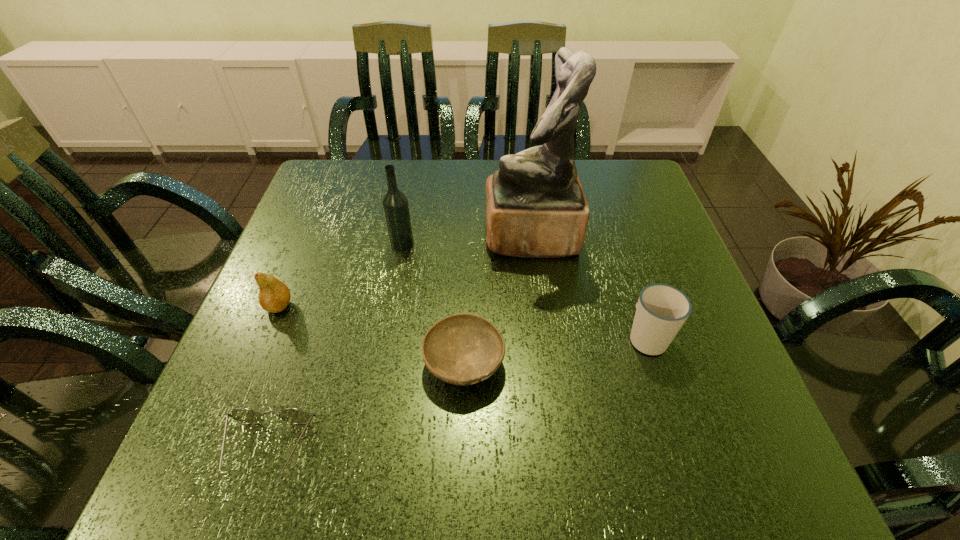
Identify the location of vacant space located 0.210m on the back of the fifth shortest object. (413, 185).

Image resolution: width=960 pixels, height=540 pixels. What are the coordinates of `free space located with a handle on the side of the cup` in the screenshot? It's located at (606, 209).

Locate an element on the screen. free space located 0.160m with a handle on the side of the cup is located at coordinates (622, 261).

Find the location of a particular element. Image resolution: width=960 pixels, height=540 pixels. free space located 0.400m with a handle on the side of the cup is located at coordinates (602, 198).

Locate an element on the screen. The height and width of the screenshot is (540, 960). vacant space situated on the front of the pear is located at coordinates (255, 366).

I want to click on vacant position located 0.370m on the right of the bowl, so click(708, 363).

The height and width of the screenshot is (540, 960). Identify the location of object that is positioned at the near edge. (245, 415).

Image resolution: width=960 pixels, height=540 pixels. Find the location of `pear at the left edge`. pear at the left edge is located at coordinates click(x=274, y=296).

At what (x,y) coordinates should I click in order to perform the action: click on spectacles at the left edge. Please return your answer as a coordinate pair (x, y). The width and height of the screenshot is (960, 540). Looking at the image, I should click on (245, 415).

Locate an element on the screen. The image size is (960, 540). object at the right edge is located at coordinates (661, 310).